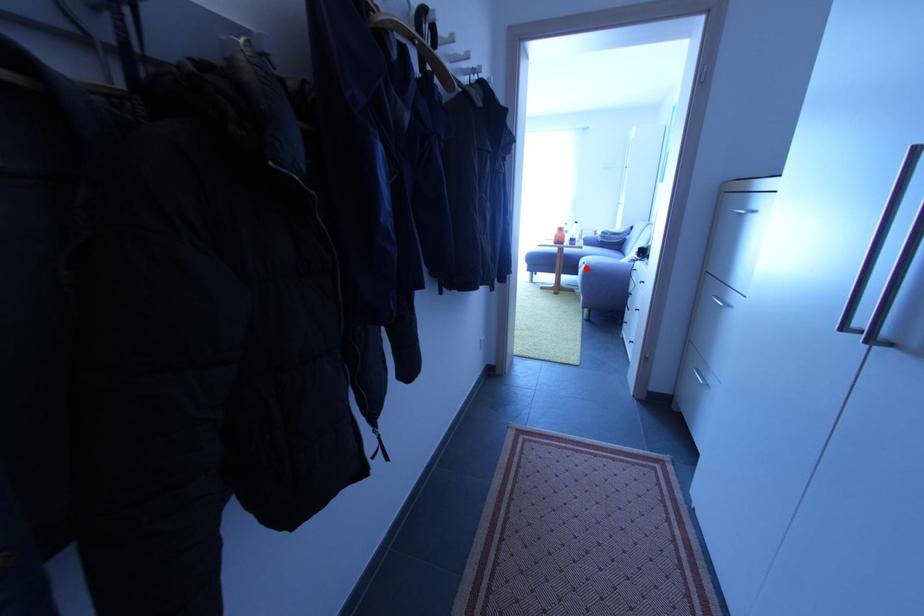
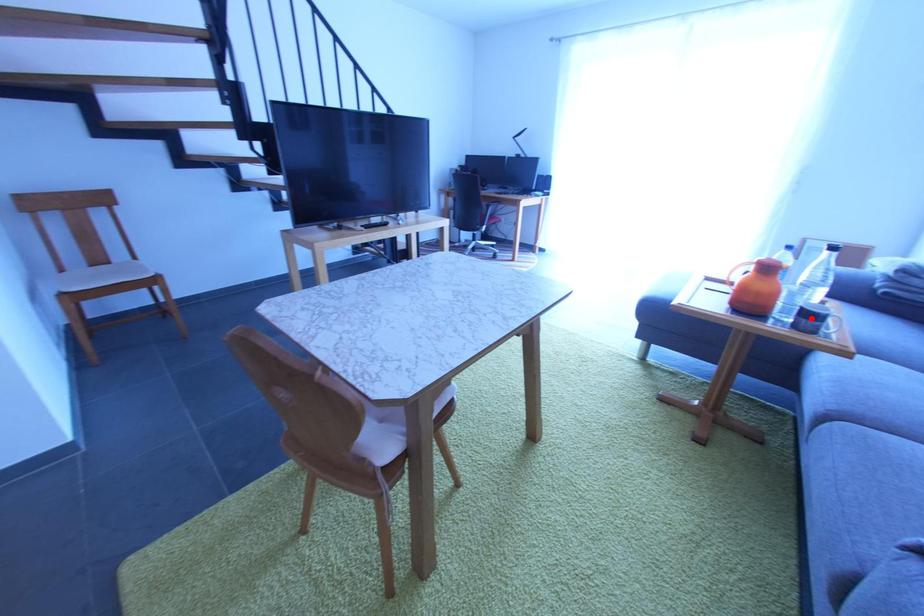
I am providing you with two images of the same scene from different viewpoints. A red point is marked on the first image and another point is marked on the second image. Do the highlighted points in image1 and image2 indicate the same real-world spot?

No